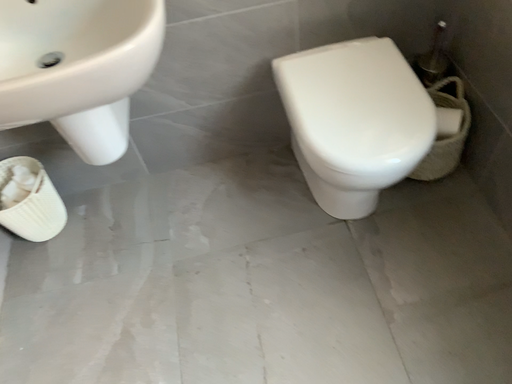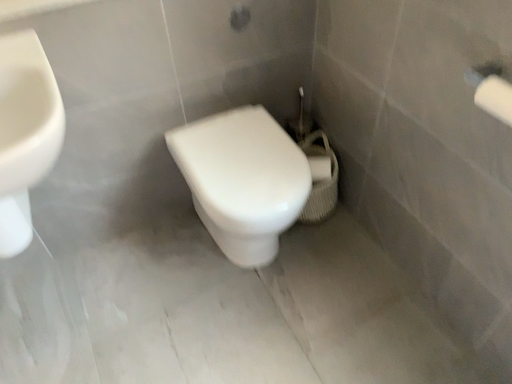
Question: Which way did the camera rotate in the video?

Choices:
 (A) rotated right
 (B) rotated left

Answer: (A)